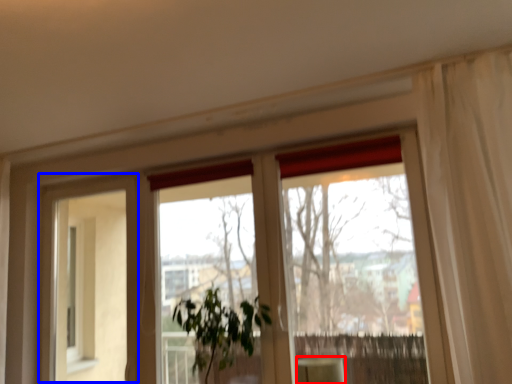
Question: Which object appears farthest to the camera in this image, furniture (highlighted by a red box) or screen door (highlighted by a blue box)?

Choices:
 (A) furniture
 (B) screen door

Answer: (B)